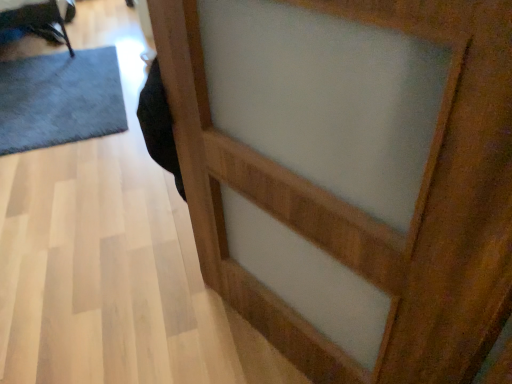
Question: From a real-world perspective, is wooden barn door at center located beneath dark gray carpet at left?

Choices:
 (A) no
 (B) yes

Answer: (A)

Question: Considering the relative positions of wooden barn door at center and dark gray carpet at left in the image provided, is wooden barn door at center to the right of dark gray carpet at left from the viewer's perspective?

Choices:
 (A) no
 (B) yes

Answer: (B)

Question: Is wooden barn door at center positioned behind dark gray carpet at left?

Choices:
 (A) no
 (B) yes

Answer: (A)

Question: Is wooden barn door at center with dark gray carpet at left?

Choices:
 (A) no
 (B) yes

Answer: (A)

Question: Considering the relative sizes of wooden barn door at center and dark gray carpet at left in the image provided, is wooden barn door at center thinner than dark gray carpet at left?

Choices:
 (A) yes
 (B) no

Answer: (A)

Question: From the image's perspective, is wooden barn door at center under dark gray carpet at left?

Choices:
 (A) yes
 (B) no

Answer: (A)

Question: Is wooden barn door at center at the back of dark gray carpet at left?

Choices:
 (A) yes
 (B) no

Answer: (B)

Question: Does dark gray carpet at left appear on the right side of wooden barn door at center?

Choices:
 (A) yes
 (B) no

Answer: (B)

Question: Is dark gray carpet at left far away from wooden barn door at center?

Choices:
 (A) yes
 (B) no

Answer: (A)

Question: Is dark gray carpet at left outside of wooden barn door at center?

Choices:
 (A) no
 (B) yes

Answer: (B)

Question: Can you confirm if dark gray carpet at left is positioned to the left of wooden barn door at center?

Choices:
 (A) yes
 (B) no

Answer: (A)

Question: Is dark gray carpet at left in front of wooden barn door at center?

Choices:
 (A) no
 (B) yes

Answer: (A)

Question: From the image's perspective, is dark gray carpet at left positioned above or below wooden barn door at center?

Choices:
 (A) above
 (B) below

Answer: (A)